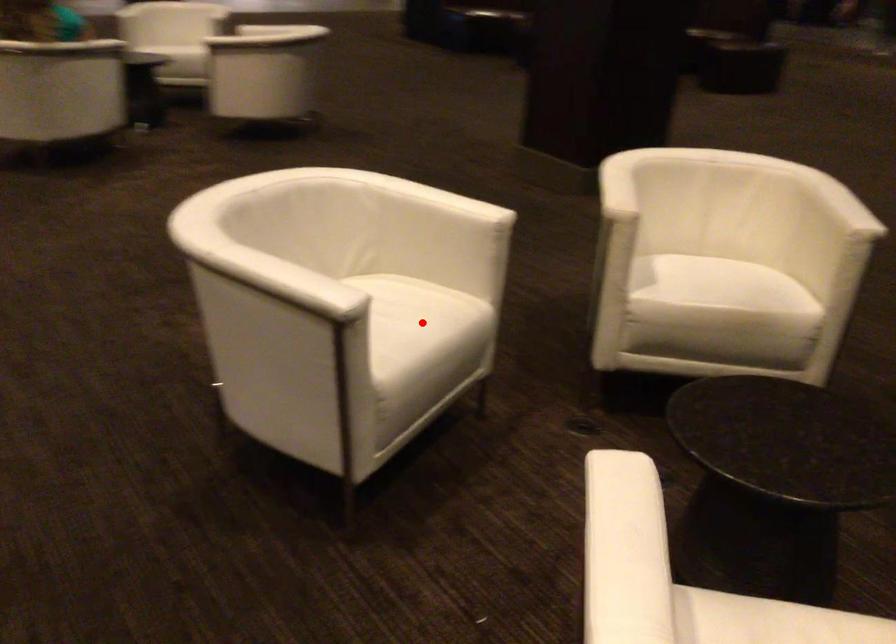
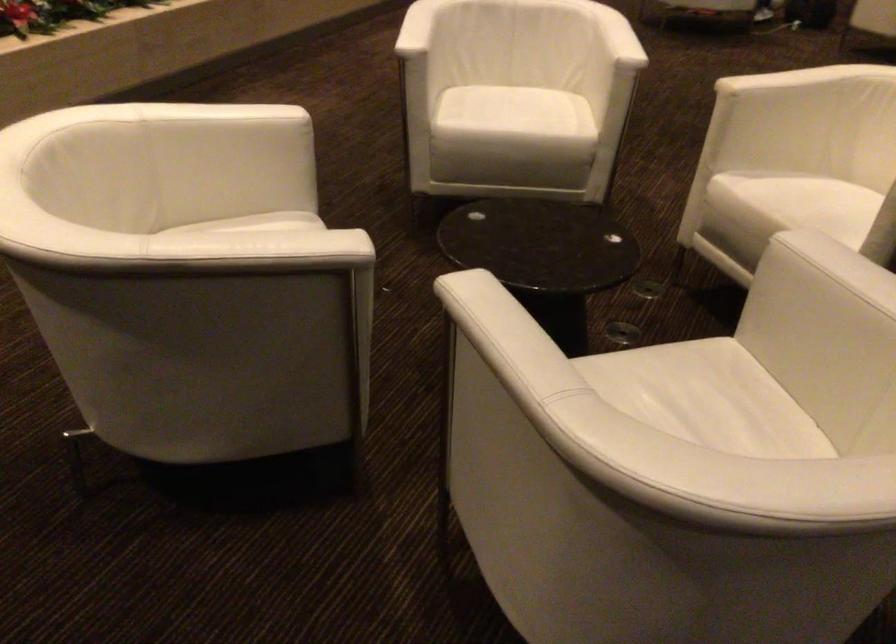
In the second image, find the point that corresponds to the highlighted location in the first image.

(524, 117)